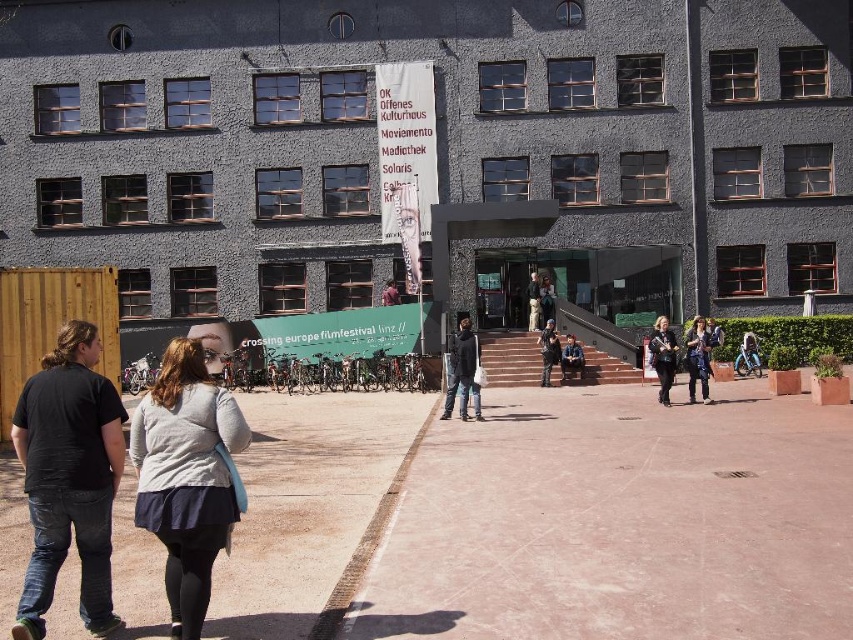
You are a city planner analyzing the plaza in front of the building. You need to determine if the pink concrete pavement at center can accommodate the matte black jacket at lower right if it were moved there. Based on their sizes, what is your conclusion?

The pink concrete pavement at center occupies less space than the matte black jacket at lower right, so it cannot accommodate the matte black jacket at lower right if moved there.

From the picture: You are standing in the plaza in front of the building and want to take a photo of both the point at (764, 566) and the point at (41, 397). Which point should you focus on first to ensure both are in focus?

You should focus on the point at (41, 397) first because it is closer to you than the point at (764, 566), which is further away. By focusing on the closer point, the further point will also be within the depth of field.

You are a tourist standing in front of the building and want to reach the entrance. You see the pink concrete pavement at center and the black cotton shirt at left. Which object is closer to you?

The pink concrete pavement at center is closer to you because it is further to the viewer than the black cotton shirt at left, meaning it is nearer in your line of sight.